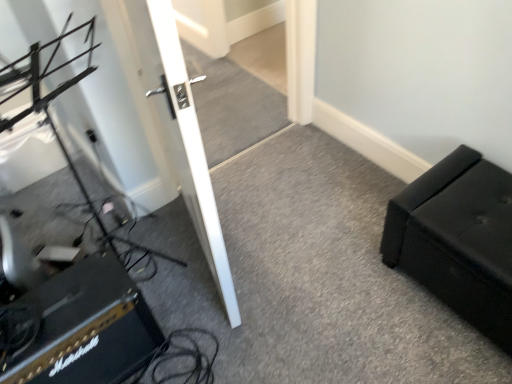
The image size is (512, 384). I want to click on black leather ottoman at right, so click(x=458, y=239).

What are the coordinates of `black textured amplifier at lower left` in the screenshot? It's located at (78, 327).

I want to click on black leather ottoman at right, so click(x=458, y=239).

Is black textured amplifier at lower left smaller than black leather ottoman at right?

Correct, black textured amplifier at lower left occupies less space than black leather ottoman at right.

Is black textured amplifier at lower left to the left of black leather ottoman at right from the viewer's perspective?

Indeed, black textured amplifier at lower left is positioned on the left side of black leather ottoman at right.

Are black textured amplifier at lower left and black leather ottoman at right located far from each other?

Yes.

Find the location of a particular element. The image size is (512, 384). door above the black leather ottoman at right (from a real-world perspective) is located at coordinates (182, 132).

Does point (474, 249) come in front of point (228, 268)?

That is True.

Between black leather ottoman at right and white glossy door at center, which one appears on the right side from the viewer's perspective?

black leather ottoman at right.

From the image's perspective, is black leather ottoman at right located above or below white glossy door at center?

From the image's perspective, black leather ottoman at right appears below white glossy door at center.

Considering the relative positions of white glossy door at center and black leather ottoman at right in the image provided, is white glossy door at center to the left of black leather ottoman at right from the viewer's perspective?

Indeed, white glossy door at center is positioned on the left side of black leather ottoman at right.

Is white glossy door at center turned away from black leather ottoman at right?

Yes, black leather ottoman at right is at the back of white glossy door at center.

Between white glossy door at center and black leather ottoman at right, which one has larger width?

With larger width is black leather ottoman at right.

Is point (182, 86) farther from viewer compared to point (488, 225)?

No, (182, 86) is closer to viewer.

From a real-world perspective, is black leather ottoman at right positioned over black textured amplifier at lower left based on gravity?

Yes, from a real-world perspective, black leather ottoman at right is on top of black textured amplifier at lower left.

Would you say black leather ottoman at right is outside black textured amplifier at lower left?

black leather ottoman at right lies outside black textured amplifier at lower left's area.

Is black leather ottoman at right far from black textured amplifier at lower left?

Yes, black leather ottoman at right is far from black textured amplifier at lower left.

Does black leather ottoman at right have a smaller size compared to black textured amplifier at lower left?

No, black leather ottoman at right is not smaller than black textured amplifier at lower left.

Is the position of white glossy door at center more distant than that of black textured amplifier at lower left?

No, the depth of white glossy door at center is less than that of black textured amplifier at lower left.

Based on the photo, does white glossy door at center appear on the left side of black textured amplifier at lower left?

No.

Where is `door that is above the black textured amplifier at lower left (from the image's perspective)`? The height and width of the screenshot is (384, 512). door that is above the black textured amplifier at lower left (from the image's perspective) is located at coordinates (182, 132).

Does white glossy door at center have a lesser width compared to black textured amplifier at lower left?

Correct, the width of white glossy door at center is less than that of black textured amplifier at lower left.

From a real-world perspective, which is physically below, black textured amplifier at lower left or white glossy door at center?

black textured amplifier at lower left is physically lower.

Looking at this image, could you tell me if black textured amplifier at lower left is facing white glossy door at center?

No, black textured amplifier at lower left is not facing towards white glossy door at center.

Based on the photo, does black textured amplifier at lower left lie behind white glossy door at center?

Yes, it is.

From the image's perspective, which is below, black textured amplifier at lower left or white glossy door at center?

black textured amplifier at lower left, from the image's perspective.

What are the coordinates of `furniture behind the black textured amplifier at lower left` in the screenshot? It's located at 458,239.

This screenshot has height=384, width=512. I want to click on door above the black leather ottoman at right (from the image's perspective), so click(x=182, y=132).

Consider the image. From the image, which object appears to be farther from black leather ottoman at right, white glossy door at center or black textured amplifier at lower left?

black textured amplifier at lower left is positioned further to the anchor black leather ottoman at right.

Estimate the real-world distances between objects in this image. Which object is closer to white glossy door at center, black textured amplifier at lower left or black leather ottoman at right?

black textured amplifier at lower left lies closer to white glossy door at center than the other object.

When comparing their distances from black leather ottoman at right, does black textured amplifier at lower left or white glossy door at center seem closer?

white glossy door at center.

Estimate the real-world distances between objects in this image. Which object is closer to white glossy door at center, black leather ottoman at right or black textured amplifier at lower left?

The object closer to white glossy door at center is black textured amplifier at lower left.

When comparing their distances from black textured amplifier at lower left, does white glossy door at center or black leather ottoman at right seem closer?

Among the two, white glossy door at center is located nearer to black textured amplifier at lower left.

Which object lies further to the anchor point black textured amplifier at lower left, black leather ottoman at right or white glossy door at center?

black leather ottoman at right lies further to black textured amplifier at lower left than the other object.

What are the coordinates of `door located between black textured amplifier at lower left and black leather ottoman at right in the left-right direction` in the screenshot? It's located at (182, 132).